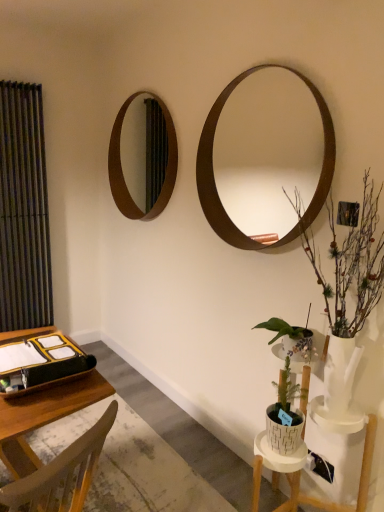
Question: Is matte black curtain at left oriented towards brown wooden mirror at upper right, placed as the first mirror when sorted from right to left?

Choices:
 (A) no
 (B) yes

Answer: (A)

Question: From a real-world perspective, is matte black curtain at left located beneath brown wooden mirror at upper right, placed as the first mirror when sorted from right to left?

Choices:
 (A) no
 (B) yes

Answer: (B)

Question: Is matte black curtain at left not near brown wooden mirror at upper right, the second mirror viewed from the left?

Choices:
 (A) yes
 (B) no

Answer: (A)

Question: Can you confirm if matte black curtain at left is smaller than brown wooden mirror at upper right, acting as the 1th mirror starting from the front?

Choices:
 (A) yes
 (B) no

Answer: (B)

Question: Is matte black curtain at left touching brown wooden mirror at upper right, acting as the 1th mirror starting from the front?

Choices:
 (A) no
 (B) yes

Answer: (A)

Question: Looking at the image, does brown wooden mirror at upper left, arranged as the 2th mirror when viewed from the front, seem bigger or smaller compared to brown wooden mirror at upper right, which appears as the second mirror when viewed from the back?

Choices:
 (A) big
 (B) small

Answer: (B)

Question: In terms of height, does brown wooden mirror at upper left, arranged as the 2th mirror when viewed from the front, look taller or shorter compared to brown wooden mirror at upper right, the second mirror viewed from the left?

Choices:
 (A) tall
 (B) short

Answer: (B)

Question: Which is correct: brown wooden mirror at upper left, marked as the 1th mirror in a back-to-front arrangement, is inside brown wooden mirror at upper right, the second mirror viewed from the left, or outside of it?

Choices:
 (A) inside
 (B) outside

Answer: (B)

Question: Considering the relative positions of brown wooden mirror at upper left, arranged as the 2th mirror when viewed from the front, and brown wooden mirror at upper right, placed as the first mirror when sorted from right to left, in the image provided, is brown wooden mirror at upper left, arranged as the 2th mirror when viewed from the front, to the left or to the right of brown wooden mirror at upper right, placed as the first mirror when sorted from right to left,?

Choices:
 (A) right
 (B) left

Answer: (B)

Question: From a real-world perspective, relative to wooden desk at lower left, is matte black curtain at left vertically above or below?

Choices:
 (A) below
 (B) above

Answer: (B)

Question: From the image's perspective, is matte black curtain at left located above or below wooden desk at lower left?

Choices:
 (A) below
 (B) above

Answer: (B)

Question: Considering the relative positions of matte black curtain at left and wooden desk at lower left in the image provided, is matte black curtain at left to the left or to the right of wooden desk at lower left?

Choices:
 (A) left
 (B) right

Answer: (A)

Question: Based on their sizes in the image, would you say matte black curtain at left is bigger or smaller than wooden desk at lower left?

Choices:
 (A) small
 (B) big

Answer: (A)

Question: Is brown wooden mirror at upper left, marked as the 1th mirror in a back-to-front arrangement, bigger or smaller than wooden desk at lower left?

Choices:
 (A) big
 (B) small

Answer: (B)

Question: Does point (135, 141) appear closer or farther from the camera than point (26, 411)?

Choices:
 (A) farther
 (B) closer

Answer: (A)